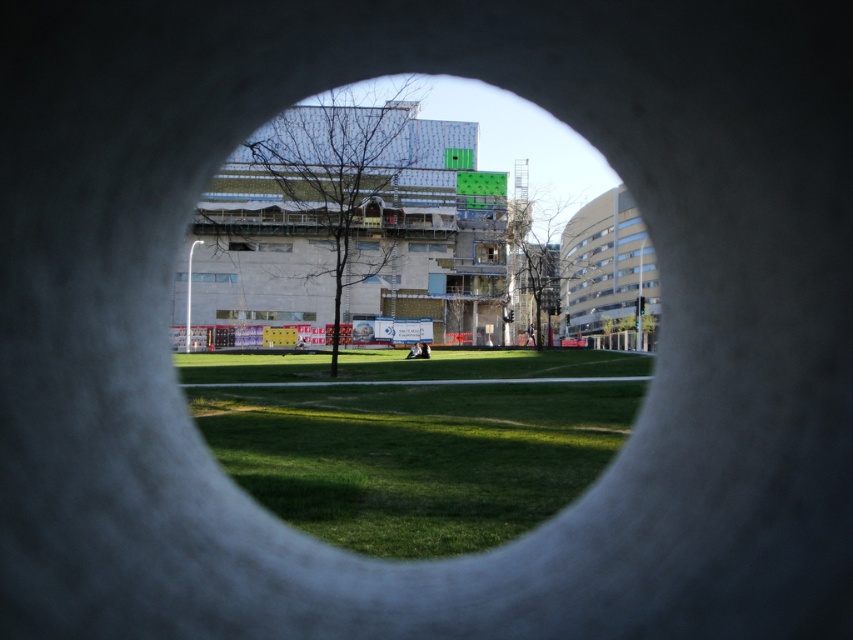
Measure the distance between white concrete hole at center and green grass at center.

white concrete hole at center is 12.79 meters from green grass at center.

Can you confirm if white concrete hole at center is shorter than green grass at center?

Incorrect, white concrete hole at center's height does not fall short of green grass at center's.

Where is `white concrete hole at center`? white concrete hole at center is located at coordinates point(403,339).